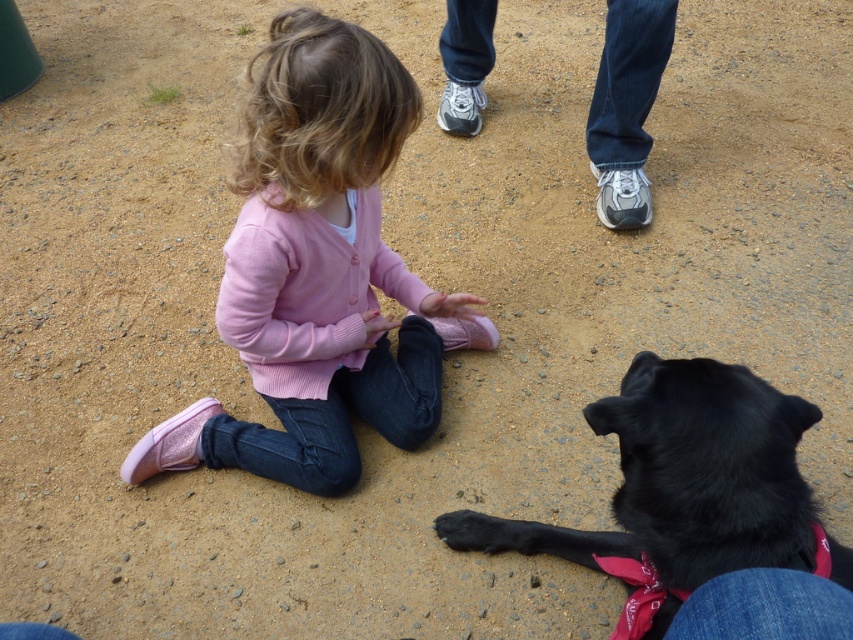
Does point (247, 180) lie in front of point (732, 460)?

No, it is not.

Can you confirm if pink matte sweater at center is bigger than black fur dog at lower right?

Correct, pink matte sweater at center is larger in size than black fur dog at lower right.

Between point (358, 76) and point (734, 480), which one is positioned in front?

Point (734, 480) is more forward.

What are the coordinates of `pink matte sweater at center` in the screenshot? It's located at (318, 269).